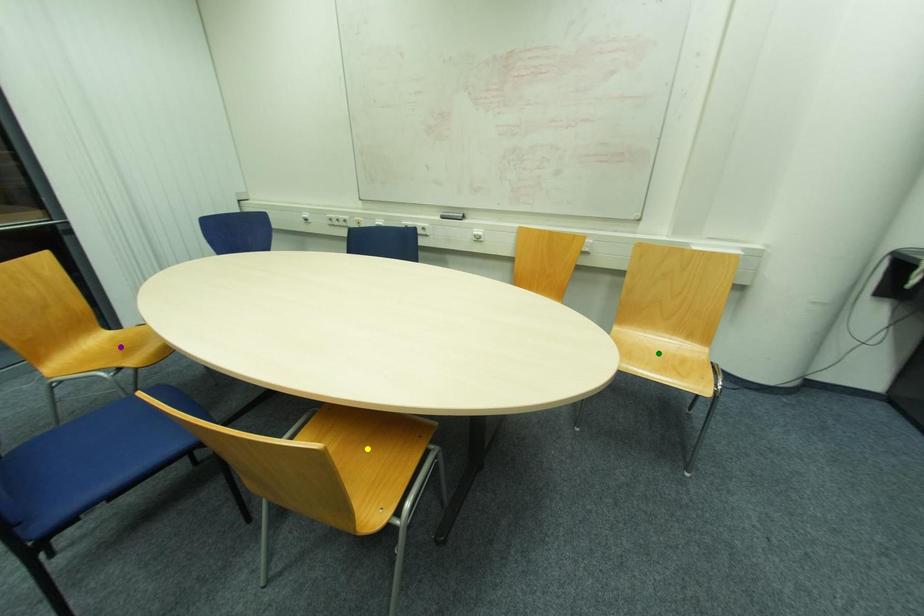
Order these from nearest to farthest:
green point | yellow point | purple point

1. yellow point
2. purple point
3. green point